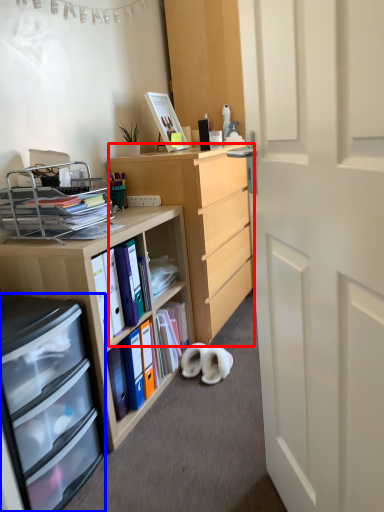
Question: Which object appears farthest to the camera in this image, desk (highlighted by a red box) or cabinetry (highlighted by a blue box)?

Choices:
 (A) desk
 (B) cabinetry

Answer: (A)